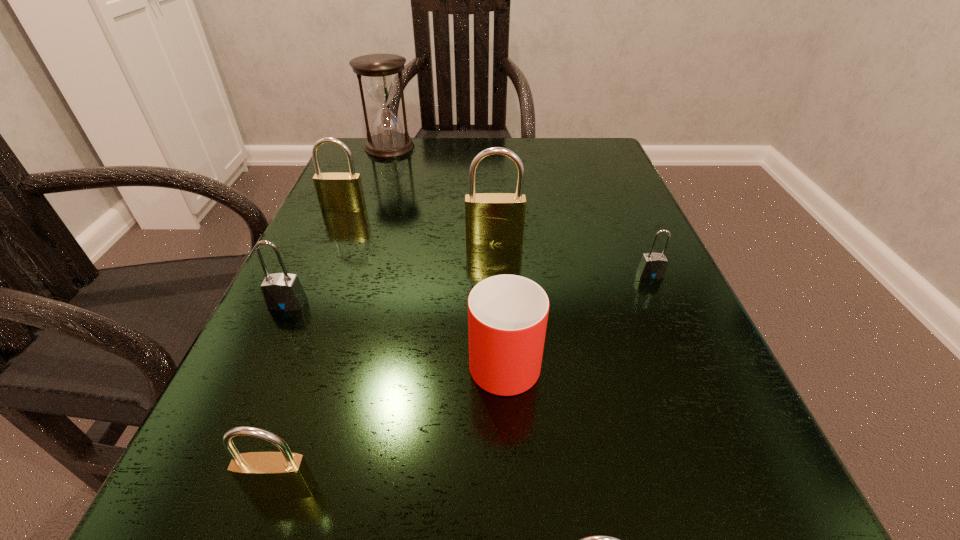
I want to click on blank space located 0.130m on the shackle of the smaller gray padlock, so click(x=680, y=339).

Locate an element on the screen. The height and width of the screenshot is (540, 960). object positioned at the far edge is located at coordinates (379, 71).

At what (x,y) coordinates should I click in order to perform the action: click on object that is at the near edge. Please return your answer as a coordinate pair (x, y). The image size is (960, 540). Looking at the image, I should click on (283, 475).

Where is `hourglass that is positioned at the left edge`? Image resolution: width=960 pixels, height=540 pixels. hourglass that is positioned at the left edge is located at coordinates (379, 71).

Where is `object at the right edge`? This screenshot has height=540, width=960. object at the right edge is located at coordinates (652, 265).

Find the location of a particular element. This screenshot has width=960, height=540. object that is at the far left corner is located at coordinates (379, 71).

Where is `object present at the near left corner`? This screenshot has width=960, height=540. object present at the near left corner is located at coordinates (283, 475).

In the image, there is a desktop. Identify the location of vacant space at the far edge. The image size is (960, 540). (500, 138).

In the image, there is a desktop. Where is `vacant space at the near edge`? This screenshot has height=540, width=960. vacant space at the near edge is located at coordinates (384, 506).

Where is `vacant area at the left edge`? Image resolution: width=960 pixels, height=540 pixels. vacant area at the left edge is located at coordinates (338, 418).